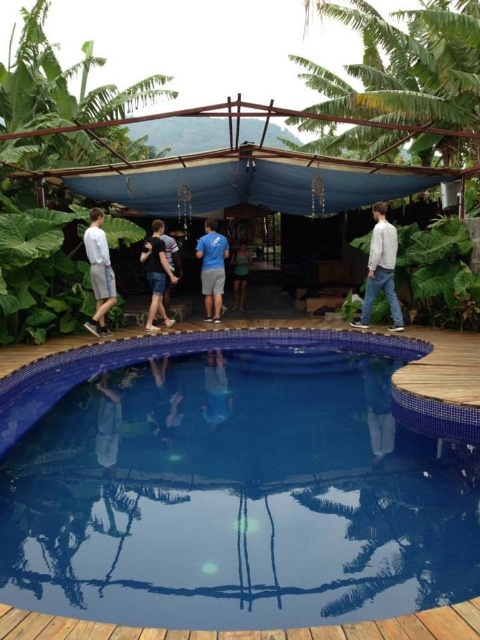
Question: Which of the following is the closest to the observer?

Choices:
 (A) blue mosaic tile swimming pool at center
 (B) white cotton shirt at right
 (C) dark blue jeans at center
 (D) wooden deck at lower center

Answer: (D)

Question: Among these points, which one is farthest from the camera?

Choices:
 (A) (388, 234)
 (B) (468, 636)

Answer: (A)

Question: Is green leafy palm tree at upper center to the left of blue fabric shirt at center from the viewer's perspective?

Choices:
 (A) no
 (B) yes

Answer: (A)

Question: Can you confirm if green leafy palm tree at upper center is bigger than blue cotton shirt at center?

Choices:
 (A) no
 (B) yes

Answer: (B)

Question: Which object is positioned closest to the dark blue jeans at center?

Choices:
 (A) blue cotton shirt at center
 (B) green leafy palm tree at upper center
 (C) white cotton shirt at right

Answer: (A)

Question: Is dark blue jeans at center to the right of blue fabric shirt at center from the viewer's perspective?

Choices:
 (A) yes
 (B) no

Answer: (B)